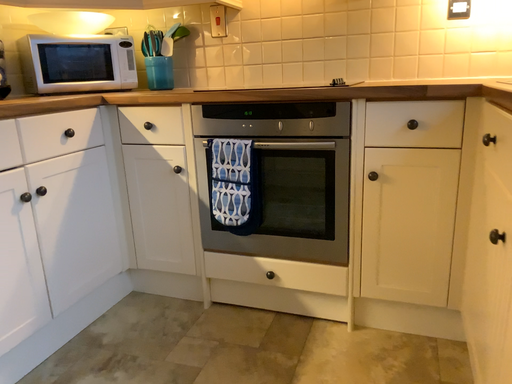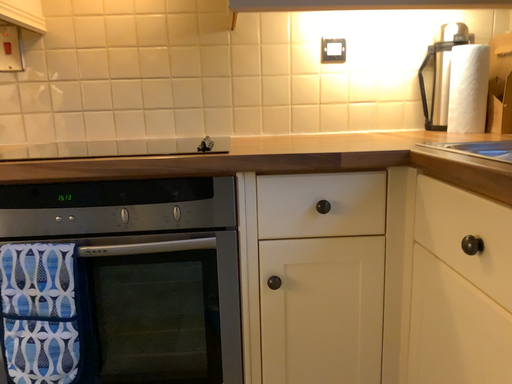
Question: Which way did the camera rotate in the video?

Choices:
 (A) rotated right
 (B) rotated left

Answer: (A)